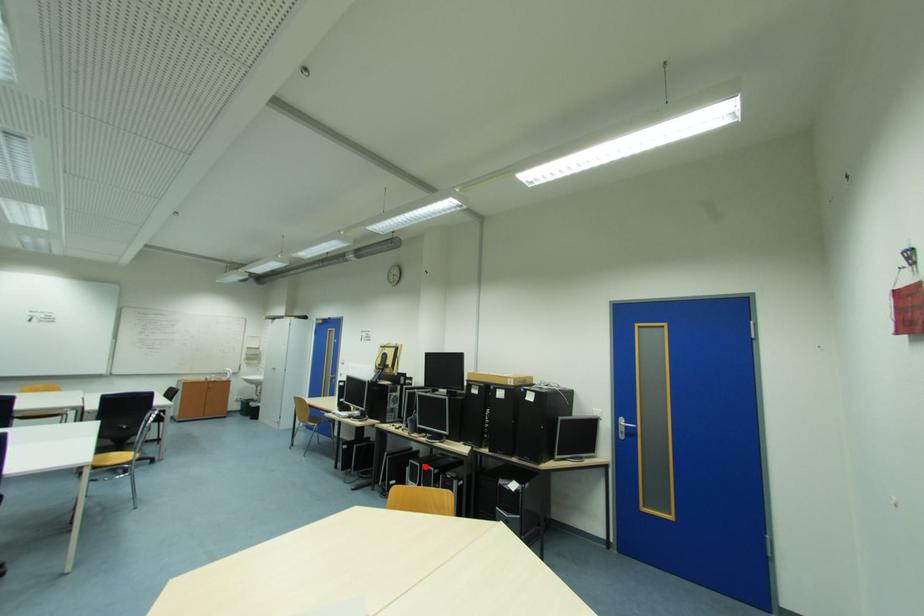
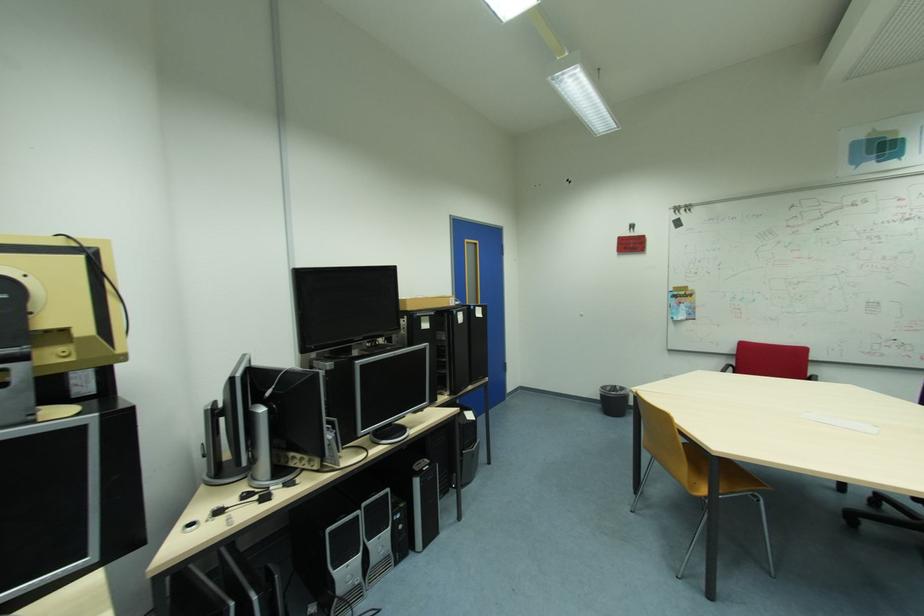
Locate, in the second image, the point that corresponds to the highlighted location in the first image.

(365, 517)